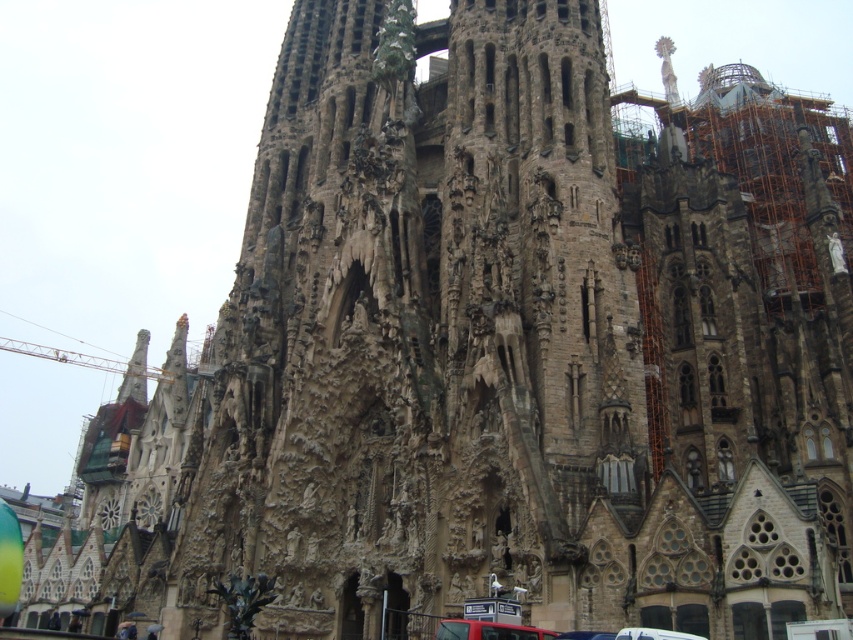
Does matte red car at lower center have a lesser width compared to white plastic car at lower center?

Incorrect, matte red car at lower center's width is not less than white plastic car at lower center's.

Which of these two, matte red car at lower center or white plastic car at lower center, stands taller?

white plastic car at lower center

The height and width of the screenshot is (640, 853). What are the coordinates of `matte red car at lower center` in the screenshot? It's located at (488, 630).